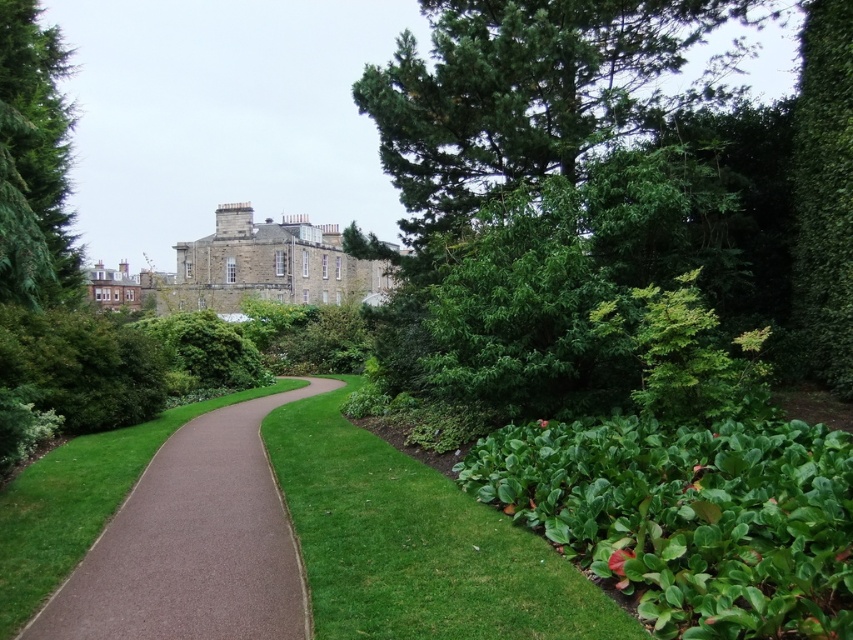
Question: Which object appears closest to the camera in this image?

Choices:
 (A) brown textured path at center
 (B) green leafy tree at upper right
 (C) green leafy grass at lower right
 (D) green leafy bush at center-right

Answer: (C)

Question: Does green leafy tree at upper left come in front of green leafy bush at center-right?

Choices:
 (A) yes
 (B) no

Answer: (A)

Question: Which of the following is the closest to the observer?

Choices:
 (A) (422, 193)
 (B) (543, 566)

Answer: (B)

Question: Can you confirm if green leafy tree at upper right is bigger than green leafy grass at lower right?

Choices:
 (A) yes
 (B) no

Answer: (A)

Question: Is green leafy tree at upper right to the left of green leafy bush at center-right from the viewer's perspective?

Choices:
 (A) yes
 (B) no

Answer: (B)

Question: Which point appears farthest from the camera in this image?

Choices:
 (A) (41, 77)
 (B) (462, 77)
 (C) (596, 310)

Answer: (A)